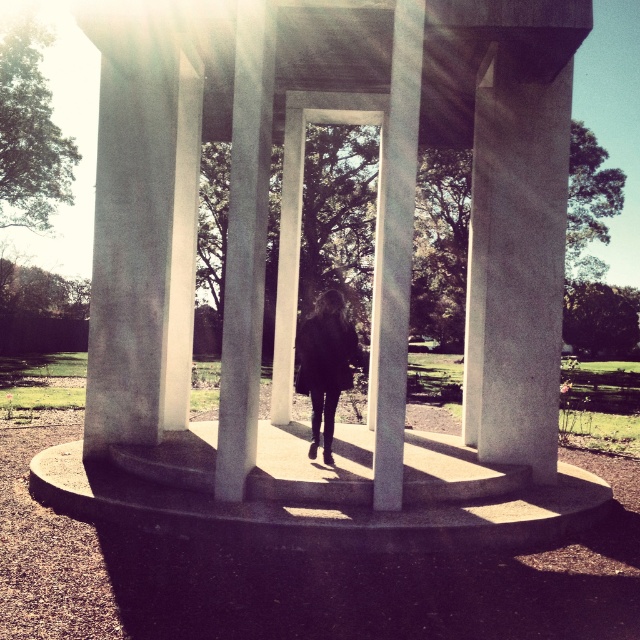
Between white concrete gazebo at center and dark matte coat at center, which one is positioned lower?

dark matte coat at center

Can you confirm if white concrete gazebo at center is taller than dark matte coat at center?

Yes.

The image size is (640, 640). What do you see at coordinates (378, 240) in the screenshot?
I see `white concrete gazebo at center` at bounding box center [378, 240].

Find the location of a particular element. The height and width of the screenshot is (640, 640). white concrete gazebo at center is located at coordinates (378, 240).

In the scene shown: Is smooth concrete pillar at center shorter than dark matte coat at center?

No.

Image resolution: width=640 pixels, height=640 pixels. What do you see at coordinates (515, 266) in the screenshot?
I see `smooth concrete pillar at center` at bounding box center [515, 266].

Image resolution: width=640 pixels, height=640 pixels. Find the location of `smooth concrete pillar at center`. smooth concrete pillar at center is located at coordinates [515, 266].

Which is more to the right, white concrete gazebo at center or smooth concrete pillar at center?

From the viewer's perspective, smooth concrete pillar at center appears more on the right side.

Can you confirm if white concrete gazebo at center is taller than smooth concrete pillar at center?

Correct, white concrete gazebo at center is much taller as smooth concrete pillar at center.

Measure the distance between point (148, 58) and camera.

They are 8.50 meters apart.

Locate an element on the screen. This screenshot has width=640, height=640. white concrete gazebo at center is located at coordinates (378, 240).